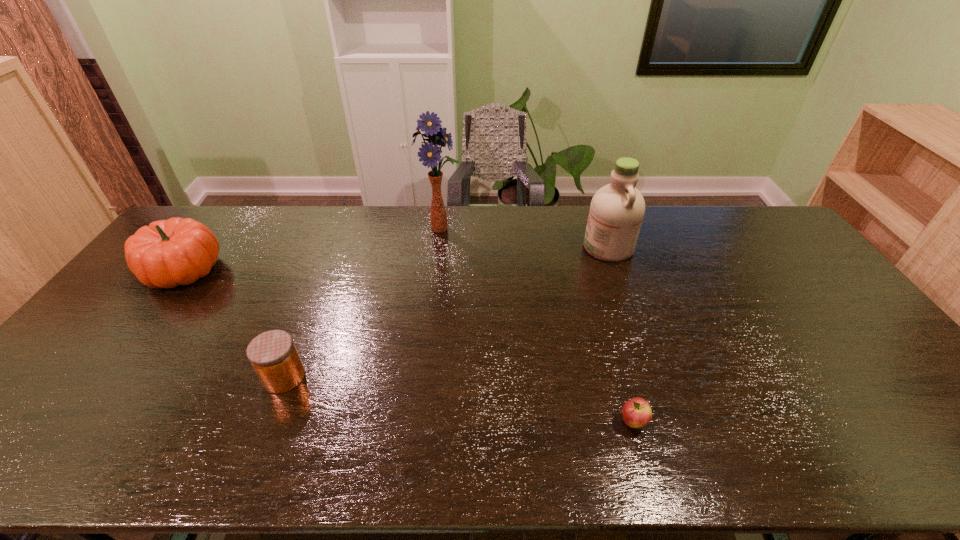
The image size is (960, 540). I want to click on the tallest object, so tap(431, 124).

At what (x,y) coordinates should I click in order to perform the action: click on flower arrangement. Please return your answer as a coordinate pair (x, y). Looking at the image, I should click on (431, 124).

Find the location of `cleansing agent`. cleansing agent is located at coordinates (617, 209).

Locate an element on the screen. pumpkin is located at coordinates (167, 253).

The height and width of the screenshot is (540, 960). What are the coordinates of `the third shortest object` in the screenshot? It's located at (167, 253).

Where is `the second object from left to right`? The width and height of the screenshot is (960, 540). the second object from left to right is located at coordinates (273, 355).

Identify the location of the fourth farthest object. This screenshot has width=960, height=540. (273, 355).

Locate an element on the screen. This screenshot has height=540, width=960. the shortest object is located at coordinates (637, 413).

The height and width of the screenshot is (540, 960). I want to click on the nearest object, so click(x=637, y=413).

Find the location of a particular element. The height and width of the screenshot is (540, 960). blank space located 0.130m on the left of the tallest object is located at coordinates (383, 230).